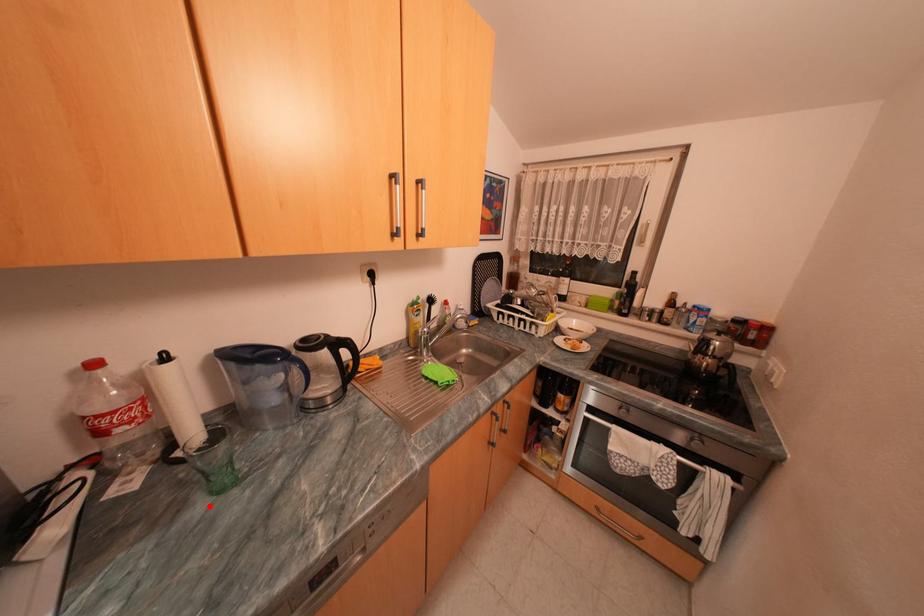
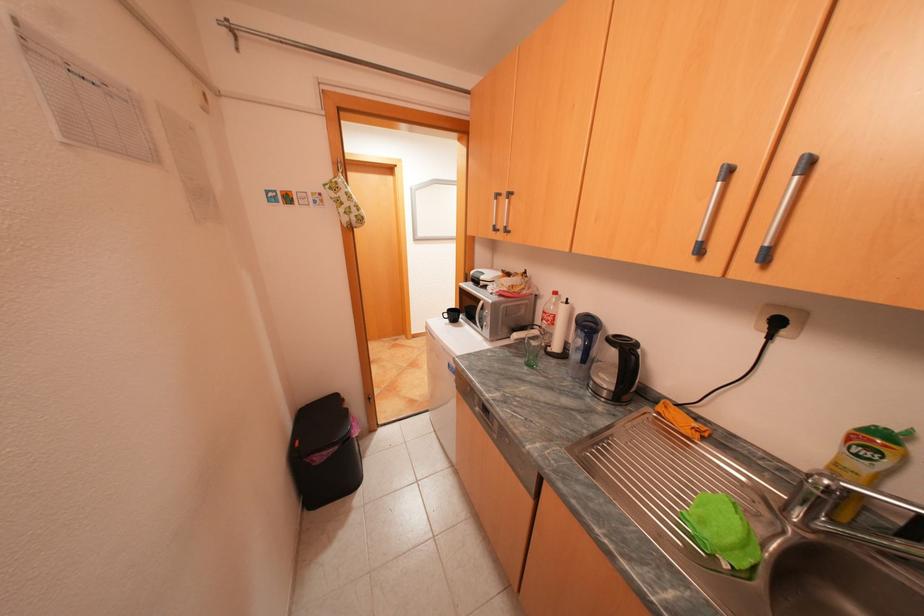
Where in the second image is the point corresponding to the highlighted location from the first image?

(530, 360)